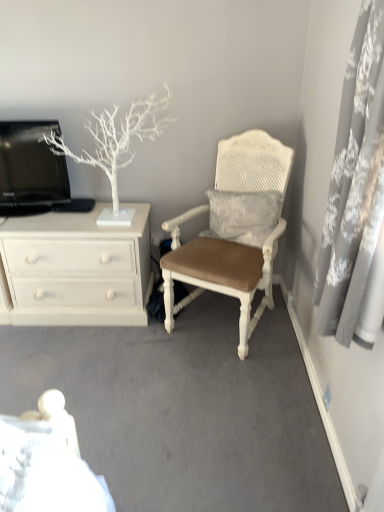
Question: Is white painted wood chest of drawers at left located within white textured cushioned chair at center?

Choices:
 (A) no
 (B) yes

Answer: (A)

Question: From a real-world perspective, is white textured cushioned chair at center on white painted wood chest of drawers at left?

Choices:
 (A) yes
 (B) no

Answer: (A)

Question: Is white textured cushioned chair at center positioned with its back to white painted wood chest of drawers at left?

Choices:
 (A) no
 (B) yes

Answer: (A)

Question: Considering the relative sizes of white textured cushioned chair at center and white painted wood chest of drawers at left in the image provided, is white textured cushioned chair at center bigger than white painted wood chest of drawers at left?

Choices:
 (A) yes
 (B) no

Answer: (A)

Question: From a real-world perspective, is white textured cushioned chair at center under white painted wood chest of drawers at left?

Choices:
 (A) no
 (B) yes

Answer: (A)

Question: In the image, is gray lace curtain at right positioned in front of or behind white painted wood chest of drawers at left?

Choices:
 (A) front
 (B) behind

Answer: (A)

Question: In terms of height, does gray lace curtain at right look taller or shorter compared to white painted wood chest of drawers at left?

Choices:
 (A) tall
 (B) short

Answer: (A)

Question: Does point [365, 153] appear closer or farther from the camera than point [82, 224]?

Choices:
 (A) farther
 (B) closer

Answer: (B)

Question: Considering the positions of gray lace curtain at right and white painted wood chest of drawers at left in the image, is gray lace curtain at right wider or thinner than white painted wood chest of drawers at left?

Choices:
 (A) wide
 (B) thin

Answer: (B)

Question: Relative to black glossy television at upper left, is gray lace curtain at right in front or behind?

Choices:
 (A) behind
 (B) front

Answer: (B)

Question: Would you say gray lace curtain at right is inside or outside black glossy television at upper left?

Choices:
 (A) outside
 (B) inside

Answer: (A)

Question: In terms of height, does gray lace curtain at right look taller or shorter compared to black glossy television at upper left?

Choices:
 (A) tall
 (B) short

Answer: (A)

Question: From the image's perspective, relative to black glossy television at upper left, is gray lace curtain at right above or below?

Choices:
 (A) below
 (B) above

Answer: (A)

Question: From a real-world perspective, is white textured cushioned chair at center above or below white matte tree at upper left?

Choices:
 (A) above
 (B) below

Answer: (B)

Question: In terms of size, does white textured cushioned chair at center appear bigger or smaller than white matte tree at upper left?

Choices:
 (A) big
 (B) small

Answer: (A)